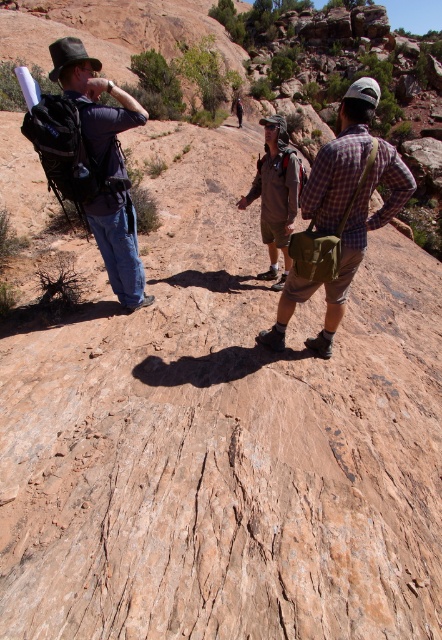
You are planning to carry both the matte black backpack at left and the brown suede jacket at center during a hike. Which one has a larger capacity for storing items?

The brown suede jacket at center has a larger capacity because it is bigger than the matte black backpack at left.

You are planning to take a photo of the plaid cotton shirt at center and the matte black backpack at left. Which object should you focus on if you want to capture both in the frame without zooming in or out?

The plaid cotton shirt at center might be wider than the matte black backpack at left, so you should focus on the plaid cotton shirt at center to ensure both fit in the frame.

You are a drone operator trying to capture aerial footage of the hiking group. You have two points marked on your map, point (357, 216) and point (281, 280). Which point should you choose to get a better view of the group?

Point (357, 216) is closer to the viewer than point (281, 280), so choosing point (357, 216) would provide a better view of the group.